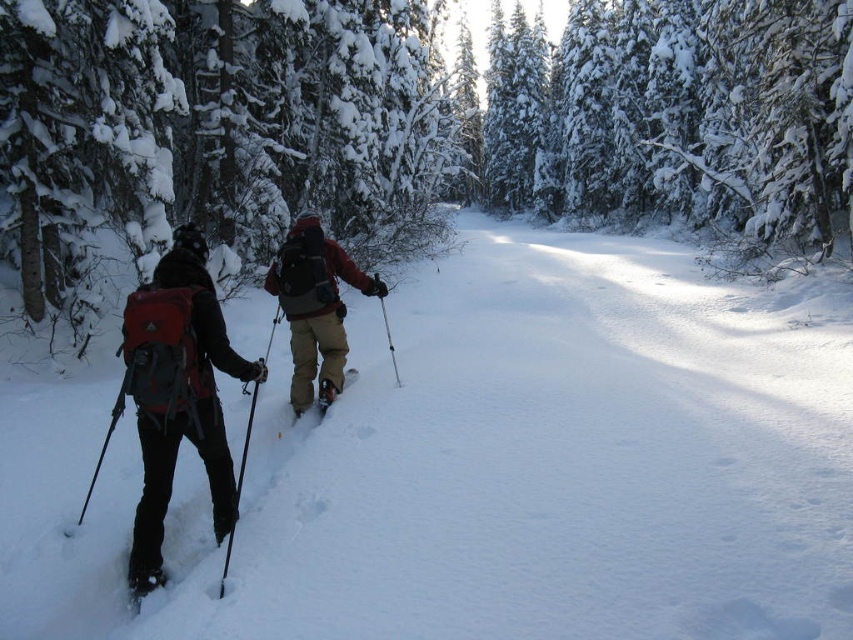
Question: Among these points, which one is nearest to the camera?

Choices:
 (A) (250, 362)
 (B) (97, 468)

Answer: (A)

Question: Which object is closer to the camera taking this photo?

Choices:
 (A) matte red backpack at left
 (B) metallic silver ski pole at center
 (C) snowy evergreen trees at center

Answer: (A)

Question: Is matte black ski pole at left to the right of metallic silver ski pole at center from the viewer's perspective?

Choices:
 (A) yes
 (B) no

Answer: (B)

Question: Estimate the real-world distances between objects in this image. Which object is farther from the white matte snowshoe at lower left?

Choices:
 (A) matte black backpack at center
 (B) metallic silver ski at center
 (C) matte red backpack at left
 (D) white fluffy snow at center

Answer: (D)

Question: Can you confirm if matte red backpack at left is smaller than metallic silver ski pole at center?

Choices:
 (A) yes
 (B) no

Answer: (B)

Question: Is white fluffy snow at center thinner than matte red backpack at left?

Choices:
 (A) no
 (B) yes

Answer: (A)